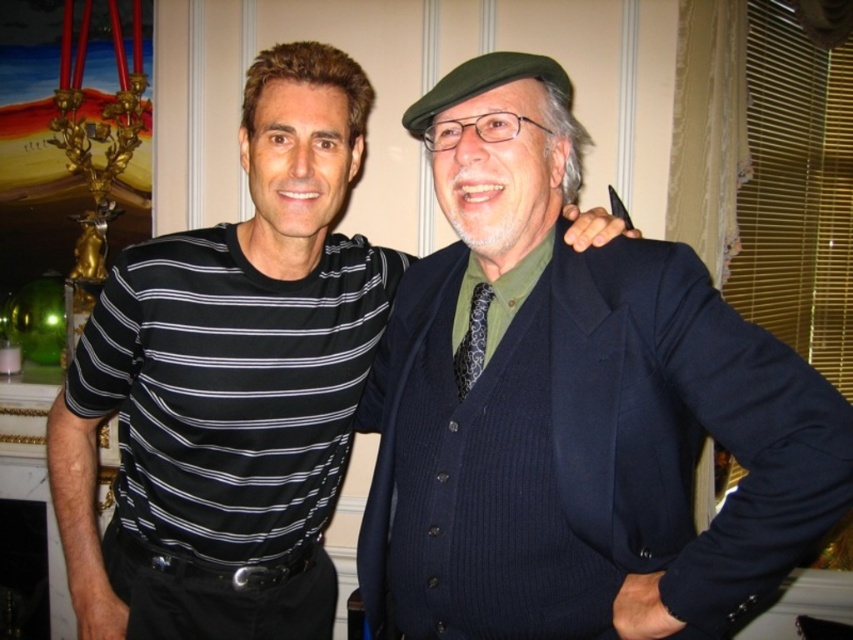
Question: Which point appears closest to the camera in this image?

Choices:
 (A) (543, 580)
 (B) (297, 193)

Answer: (A)

Question: Can you confirm if dark blue textured suit at center is thinner than black striped shirt at center?

Choices:
 (A) no
 (B) yes

Answer: (A)

Question: Where is dark blue textured suit at center located in relation to black striped shirt at center in the image?

Choices:
 (A) above
 (B) below

Answer: (B)

Question: Can you confirm if dark blue textured suit at center is thinner than black striped shirt at center?

Choices:
 (A) yes
 (B) no

Answer: (B)

Question: Which point appears closest to the camera in this image?

Choices:
 (A) (598, 225)
 (B) (612, 301)

Answer: (B)

Question: Which object appears farthest from the camera in this image?

Choices:
 (A) dark blue textured suit at center
 (B) black striped shirt at center

Answer: (B)